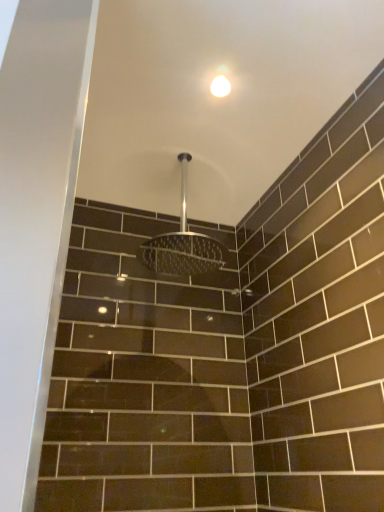
Describe the element at coordinates (182, 243) in the screenshot. I see `polished chrome showerhead at center` at that location.

Where is `polished chrome showerhead at center`? The image size is (384, 512). polished chrome showerhead at center is located at coordinates (182, 243).

Find the location of a particular element. The height and width of the screenshot is (512, 384). polished chrome showerhead at center is located at coordinates pos(182,243).